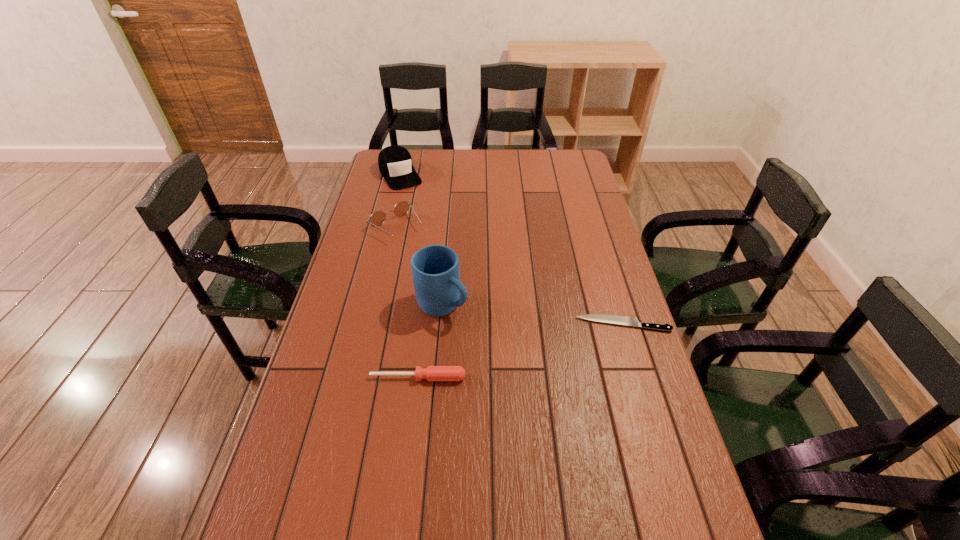
Locate an element on the screen. free space that satisfies the following two spatial constraints: 1. on the front side of the third tallest object; 2. on the right side of the cap is located at coordinates (387, 228).